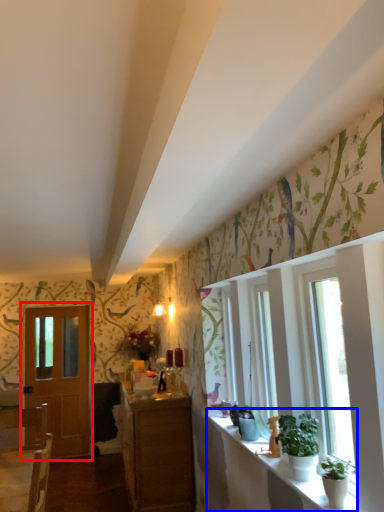
Question: Which object appears farthest to the camera in this image, door (highlighted by a red box) or window sill (highlighted by a blue box)?

Choices:
 (A) door
 (B) window sill

Answer: (A)